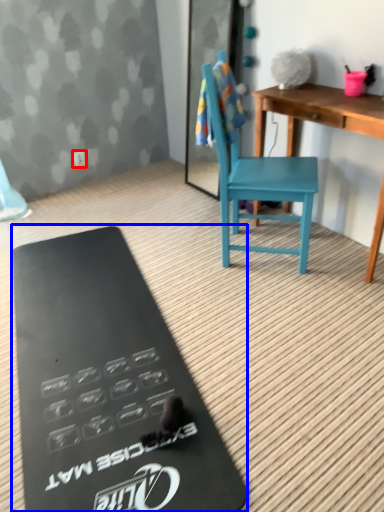
Question: Which point is closer to the camera, power outlet (highlighted by a red box) or clipboard (highlighted by a blue box)?

Choices:
 (A) power outlet
 (B) clipboard

Answer: (B)